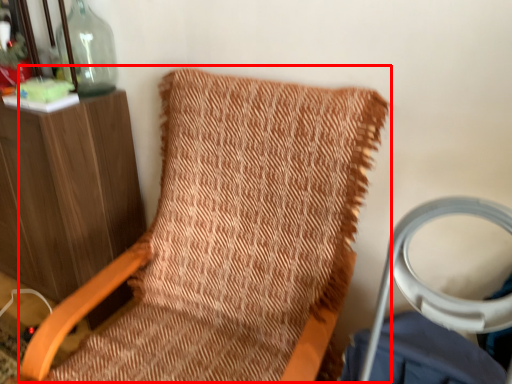
Question: Considering the relative positions of bean bag chair (annotated by the red box) and bottle in the image provided, where is bean bag chair (annotated by the red box) located with respect to the staircase?

Choices:
 (A) left
 (B) right

Answer: (B)